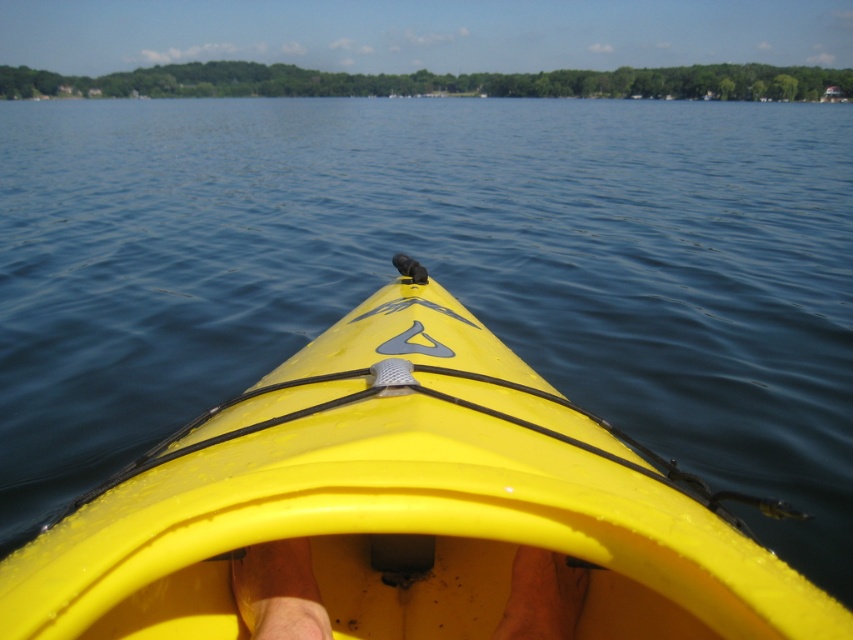
In the scene shown: You are navigating a kayak on a calm lake. Your destination is a buoy located at coordinates point 0.8, 0.5. Based on the position of yellow plastic kayak at center, can you reach the buoy directly ahead without adjusting your course?

The yellow plastic kayak at center is at point (405, 502). The buoy is at point (426, 512). Since the kayak is very close to the buoy coordinates, you can reach the buoy directly ahead without adjusting your course.